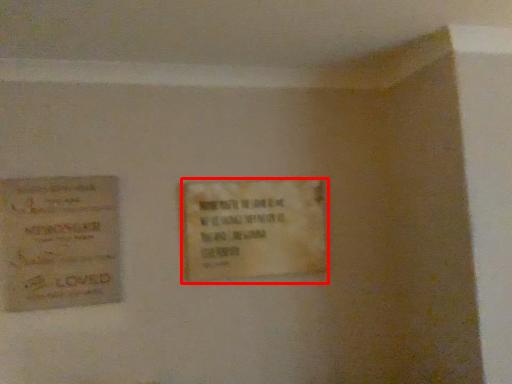
Question: From the image's perspective, what is the correct spatial positioning of plaque (annotated by the red box) in reference to poster?

Choices:
 (A) below
 (B) above

Answer: (B)